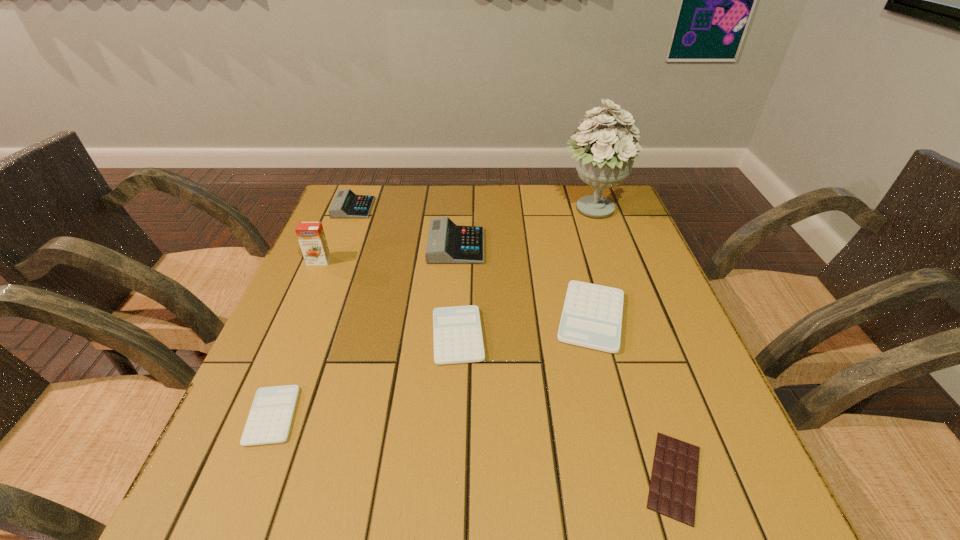
This screenshot has width=960, height=540. I want to click on the second white calculator from right to left, so click(x=457, y=334).

I want to click on the sixth tallest object, so click(x=457, y=334).

The width and height of the screenshot is (960, 540). I want to click on the seventh tallest object, so click(269, 421).

Locate an element on the screen. the leftmost white calculator is located at coordinates (269, 421).

Image resolution: width=960 pixels, height=540 pixels. I want to click on chocolate bar, so click(x=673, y=486).

The height and width of the screenshot is (540, 960). I want to click on the shortest object, so click(673, 486).

Locate an element on the screen. The width and height of the screenshot is (960, 540). vacant space located on the left of the green bouquet is located at coordinates (538, 210).

At what (x,y) coordinates should I click in order to perform the action: click on vacant space located 0.100m on the back of the second tallest object. Please return your answer as a coordinate pair (x, y). Looking at the image, I should click on (330, 234).

You are a GUI agent. You are given a task and a screenshot of the screen. Output one action in this format:
    pyautogui.click(x=<x>, y=<y>)
    Task: Click on the vacant area situated on the front of the bigger gray calculator
    
    Given the screenshot: What is the action you would take?
    pyautogui.click(x=449, y=349)

The width and height of the screenshot is (960, 540). In order to click on vacant space positioned 0.190m on the front of the left gray calculator in this screenshot , I will do `click(333, 259)`.